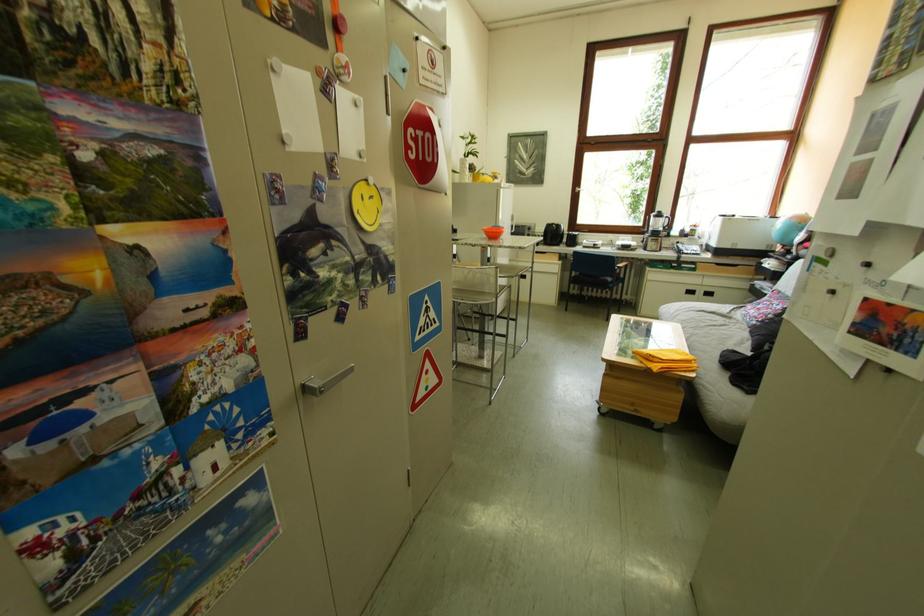
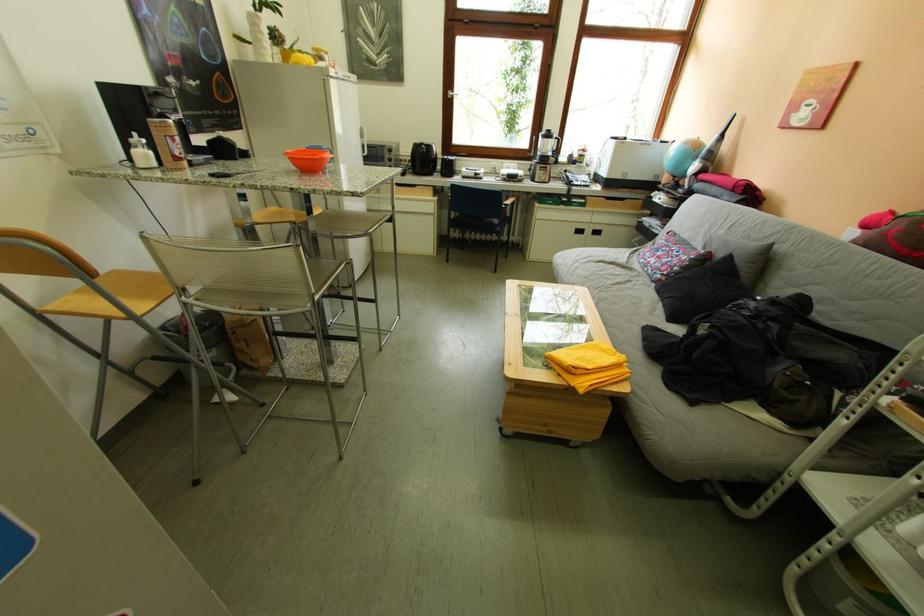
Find the pixel in the second image that matches point 497,238 in the first image.

(305, 169)